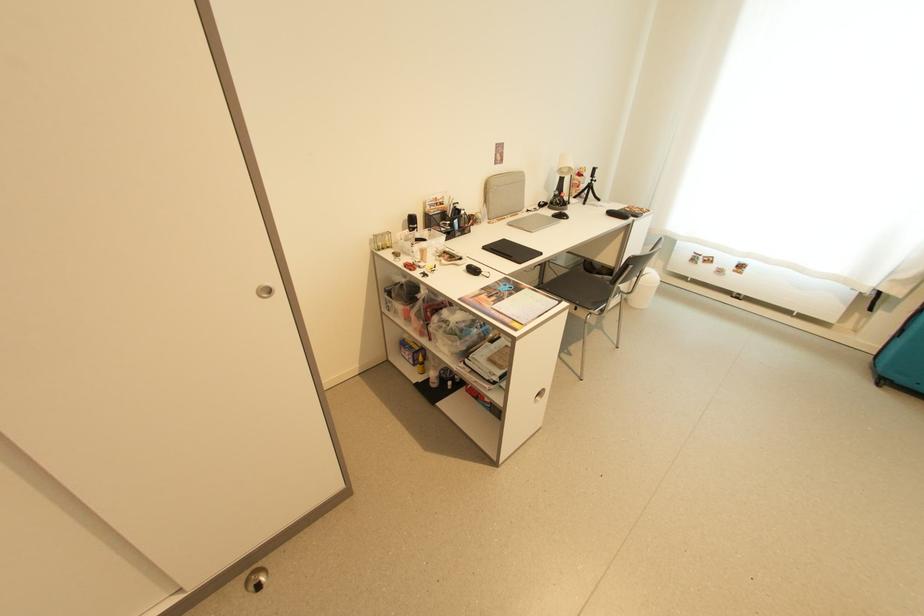
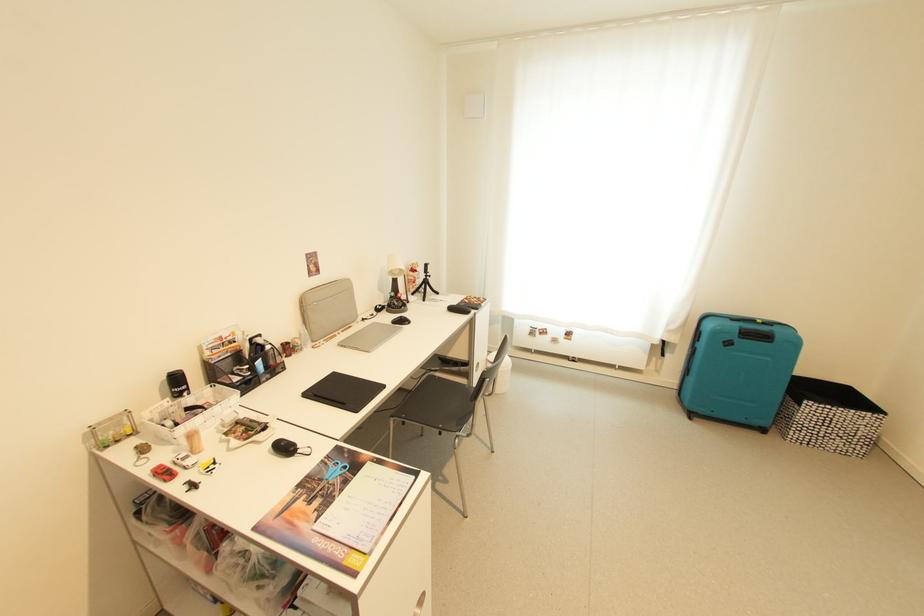
The images are taken continuously from a first-person perspective. In which direction are you moving?

The cameraman moved toward right, forward.